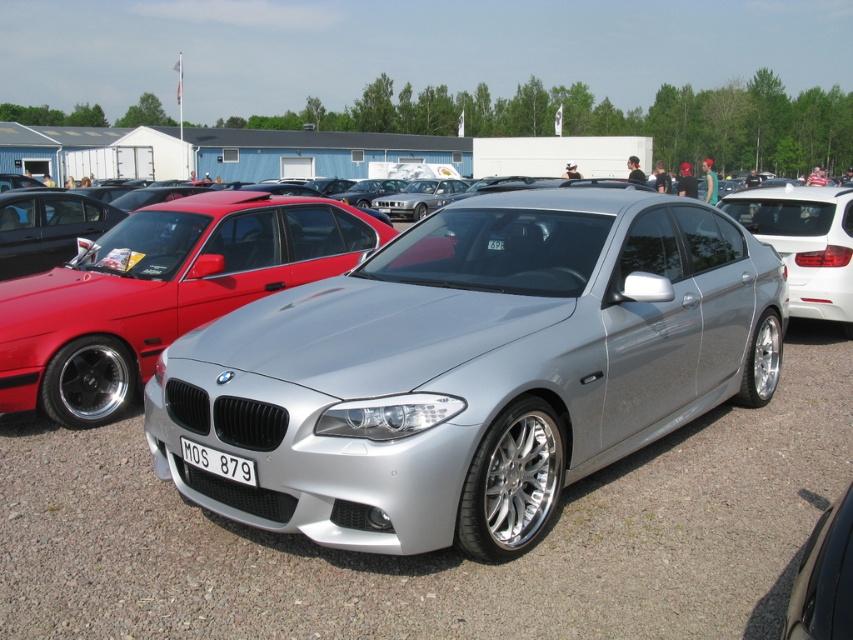
Question: Among these points, which one is nearest to the camera?

Choices:
 (A) (198, 444)
 (B) (306, 596)
 (C) (749, 198)

Answer: (B)

Question: In this image, where is satin silver sedan at center located relative to white plastic license plate at front?

Choices:
 (A) below
 (B) above

Answer: (B)

Question: Does silver metallic car at center have a smaller size compared to satin silver sedan at center?

Choices:
 (A) yes
 (B) no

Answer: (A)

Question: Which point is closer to the camera?

Choices:
 (A) (202, 449)
 (B) (67, 272)

Answer: (A)

Question: Does satin silver sedan at center have a lesser width compared to white plastic license plate at front?

Choices:
 (A) yes
 (B) no

Answer: (B)

Question: Which of the following is the closest to the observer?

Choices:
 (A) (820, 266)
 (B) (747, 458)
 (C) (61, 422)

Answer: (B)